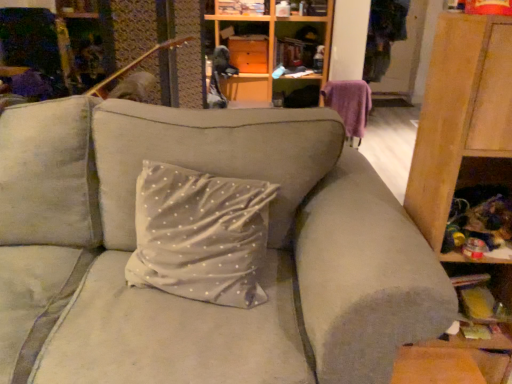
Question: Is purple fabric swivel chair at upper right surrounding wooden cabinet at right?

Choices:
 (A) no
 (B) yes

Answer: (A)

Question: From a real-world perspective, is purple fabric swivel chair at upper right physically above wooden cabinet at right?

Choices:
 (A) no
 (B) yes

Answer: (A)

Question: Considering the relative sizes of purple fabric swivel chair at upper right and wooden cabinet at right in the image provided, is purple fabric swivel chair at upper right wider than wooden cabinet at right?

Choices:
 (A) no
 (B) yes

Answer: (A)

Question: Is purple fabric swivel chair at upper right smaller than wooden cabinet at right?

Choices:
 (A) no
 (B) yes

Answer: (B)

Question: From the image's perspective, is purple fabric swivel chair at upper right located beneath wooden cabinet at right?

Choices:
 (A) no
 (B) yes

Answer: (A)

Question: Can we say purple fabric swivel chair at upper right lies outside wooden cabinet at right?

Choices:
 (A) no
 (B) yes

Answer: (B)

Question: Is matte wood cabinet at upper center oriented away from wooden cabinet at right?

Choices:
 (A) no
 (B) yes

Answer: (A)

Question: Is matte wood cabinet at upper center to the right of wooden cabinet at right from the viewer's perspective?

Choices:
 (A) yes
 (B) no

Answer: (B)

Question: Is matte wood cabinet at upper center bigger than wooden cabinet at right?

Choices:
 (A) no
 (B) yes

Answer: (A)

Question: Is matte wood cabinet at upper center next to wooden cabinet at right and touching it?

Choices:
 (A) yes
 (B) no

Answer: (B)

Question: Considering the relative sizes of matte wood cabinet at upper center and wooden cabinet at right in the image provided, is matte wood cabinet at upper center shorter than wooden cabinet at right?

Choices:
 (A) yes
 (B) no

Answer: (A)

Question: Considering the relative sizes of matte wood cabinet at upper center and wooden cabinet at right in the image provided, is matte wood cabinet at upper center thinner than wooden cabinet at right?

Choices:
 (A) no
 (B) yes

Answer: (A)

Question: Considering the relative positions of purple fabric swivel chair at upper right and matte wood cabinet at upper center in the image provided, is purple fabric swivel chair at upper right to the left of matte wood cabinet at upper center from the viewer's perspective?

Choices:
 (A) yes
 (B) no

Answer: (B)